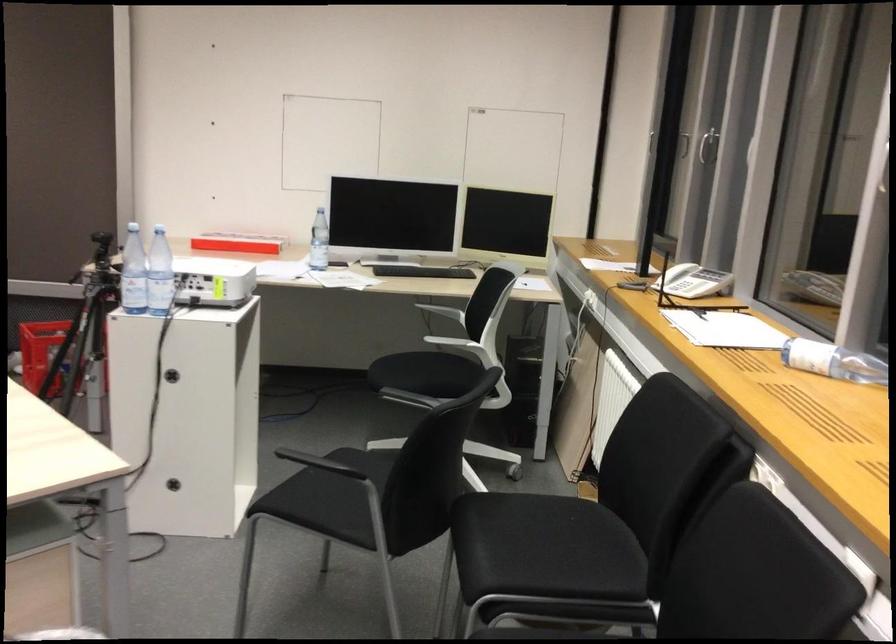
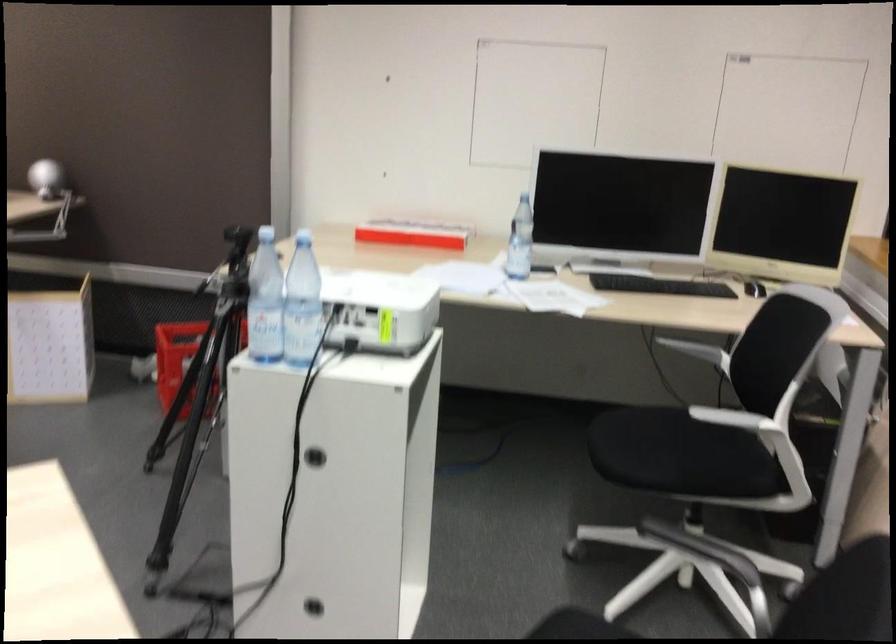
Locate, in the second image, the point that corresponds to [133,270] in the first image.

(264, 301)